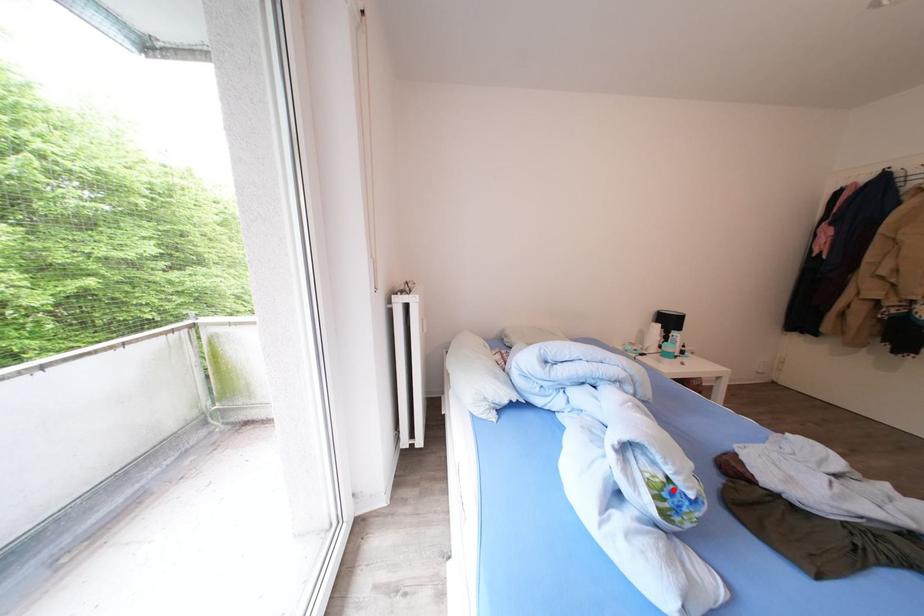
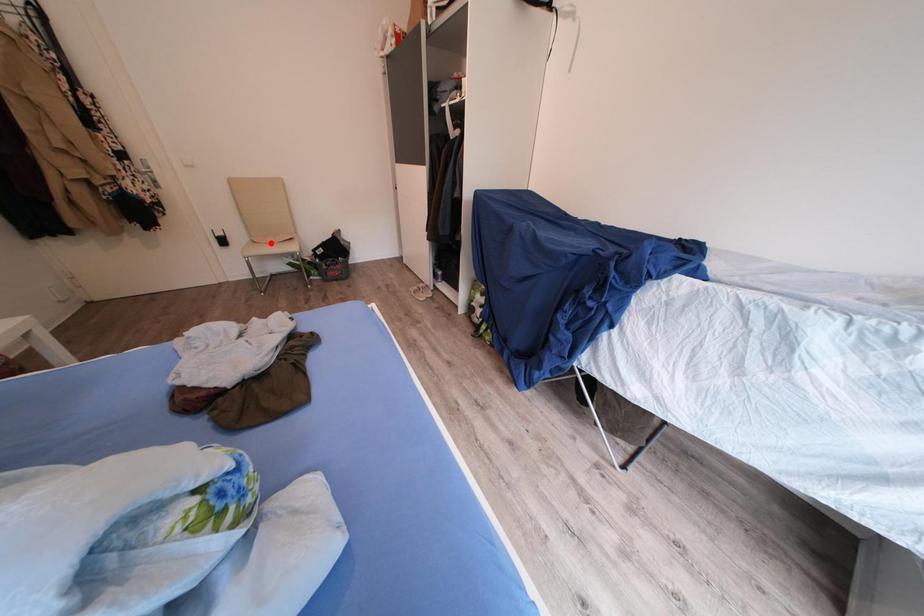
I am providing you with two images of the same scene from different viewpoints. A red point is marked on the first image and another point is marked on the second image. Is the marked point in image1 the same physical position as the marked point in image2?

No